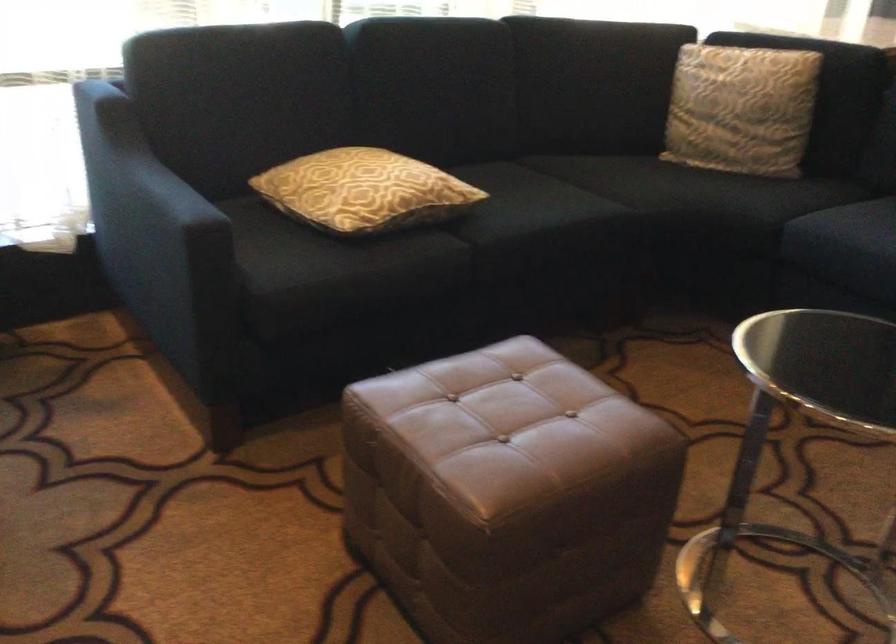
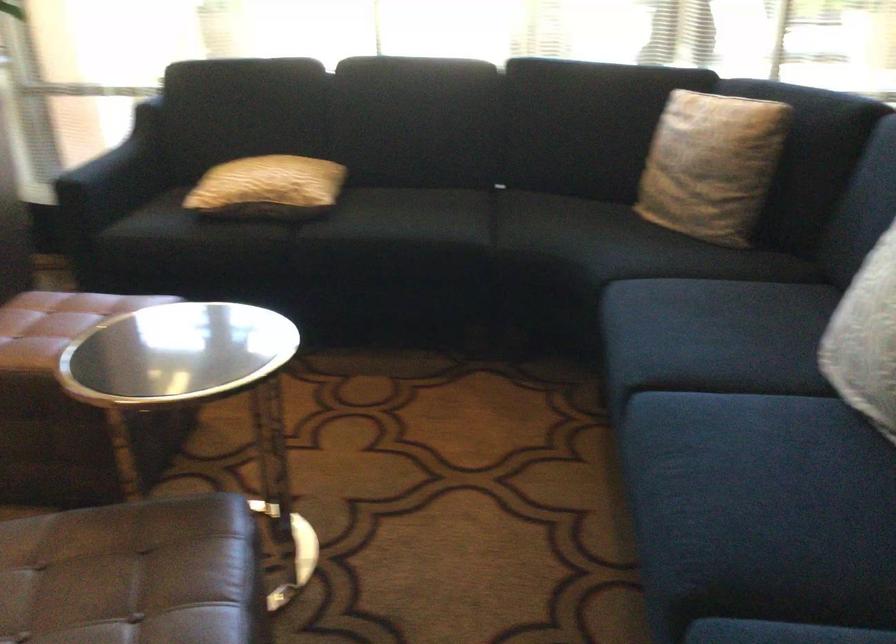
In the second image, find the point that corresponds to [418,194] in the first image.

(268, 187)